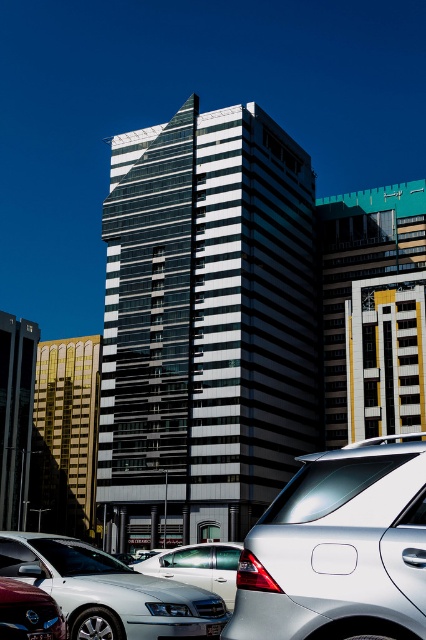
Question: Is satin silver suv at center closer to the viewer compared to silver metallic sedan at center?

Choices:
 (A) no
 (B) yes

Answer: (B)

Question: Which point is farther to the camera?

Choices:
 (A) shiny red car at lower left
 (B) black plastic license plate at center
 (C) silver metallic sedan at center
 (D) satin silver suv at center

Answer: (C)

Question: Does shiny red car at lower left have a larger size compared to black plastic license plate at center?

Choices:
 (A) no
 (B) yes

Answer: (B)

Question: Where is satin silver suv at center located in relation to black plastic license plate at center in the image?

Choices:
 (A) left
 (B) right

Answer: (B)

Question: Which of these objects is positioned closest to the silver metallic sedan at center?

Choices:
 (A) silver metallic sedan at lower left
 (B) satin silver suv at center

Answer: (A)

Question: Which object is closer to the camera taking this photo?

Choices:
 (A) silver metallic sedan at lower left
 (B) black plastic license plate at center
 (C) silver metallic sedan at center
 (D) shiny red car at lower left

Answer: (D)